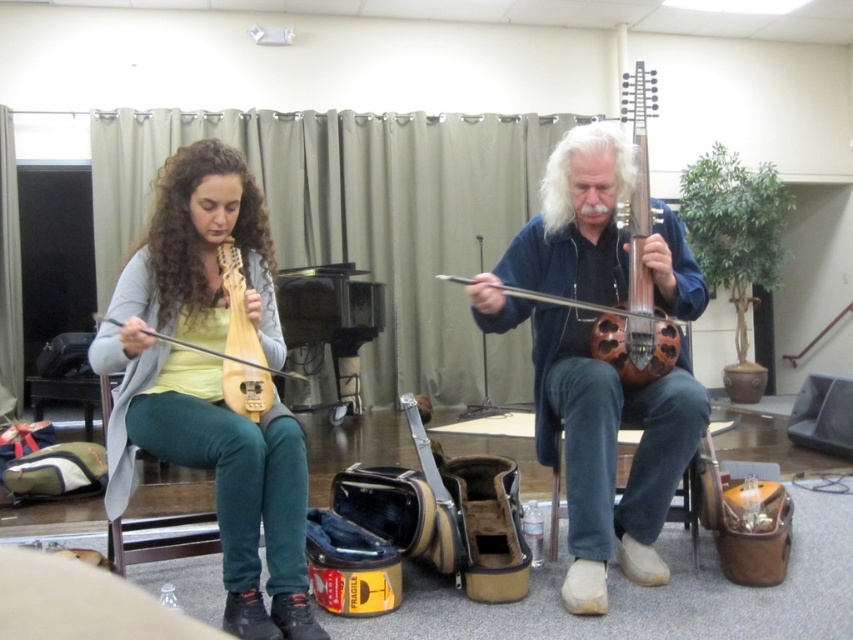
You are a photographer setting up for a shoot in the room. You want to capture both the wooden violin at center and the matte wood violin at left in your frame. Which violin should you focus on first to ensure both are in focus?

You should focus on the wooden violin at center first because it is closer to you than the matte wood violin at left, so focusing on the closer one will help ensure both are in focus.